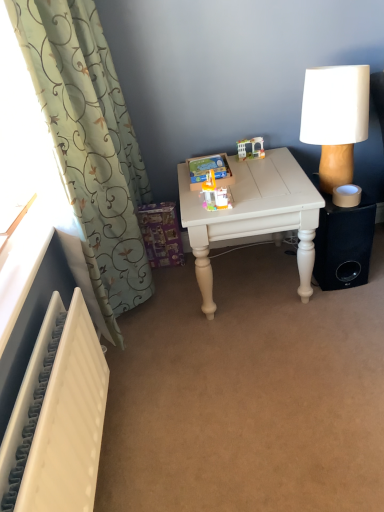
Where is `vacant area that lies between green fabric curtain at left and white painted wood table at center`? Image resolution: width=384 pixels, height=512 pixels. vacant area that lies between green fabric curtain at left and white painted wood table at center is located at coordinates (191, 313).